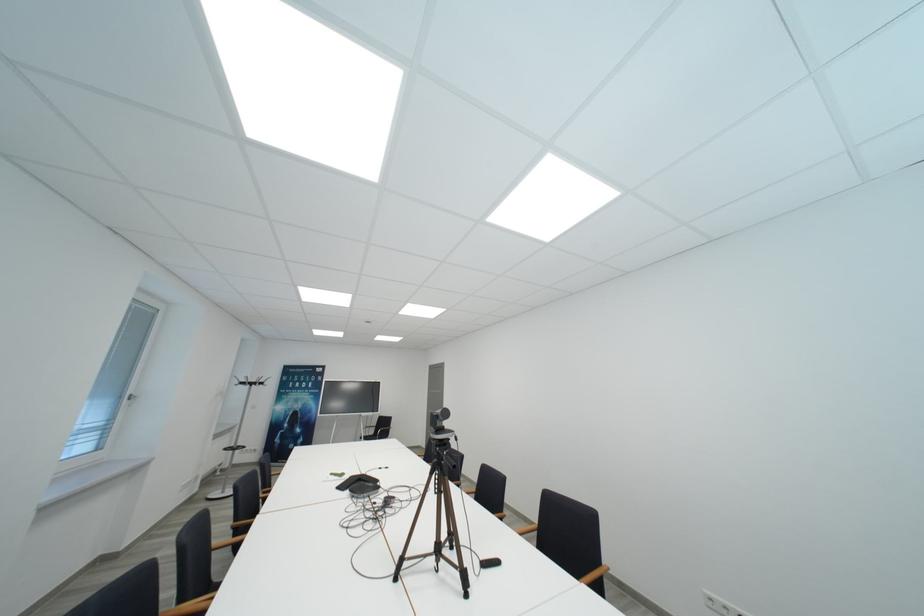
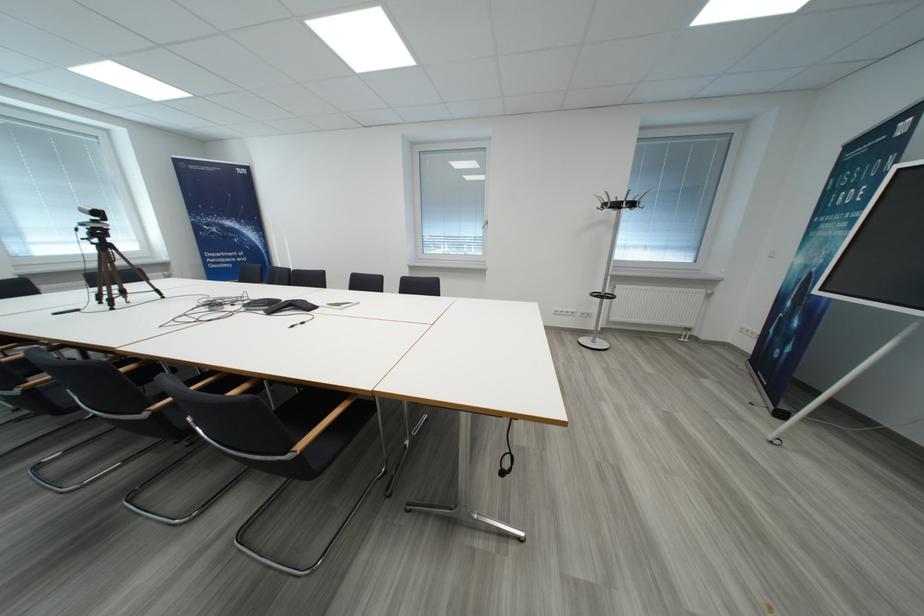
The point at [270,387] is marked in the first image. Where is the corresponding point in the second image?

(623, 208)